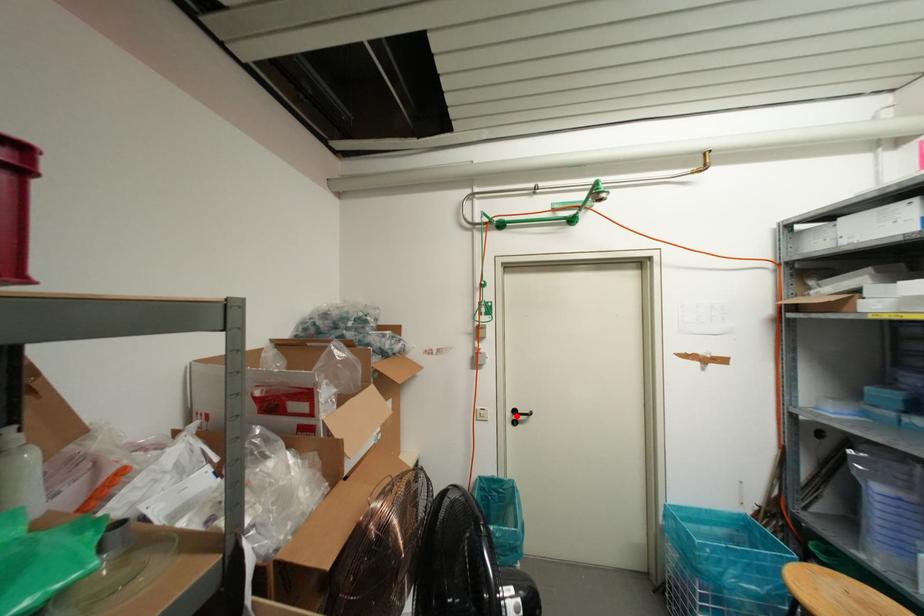
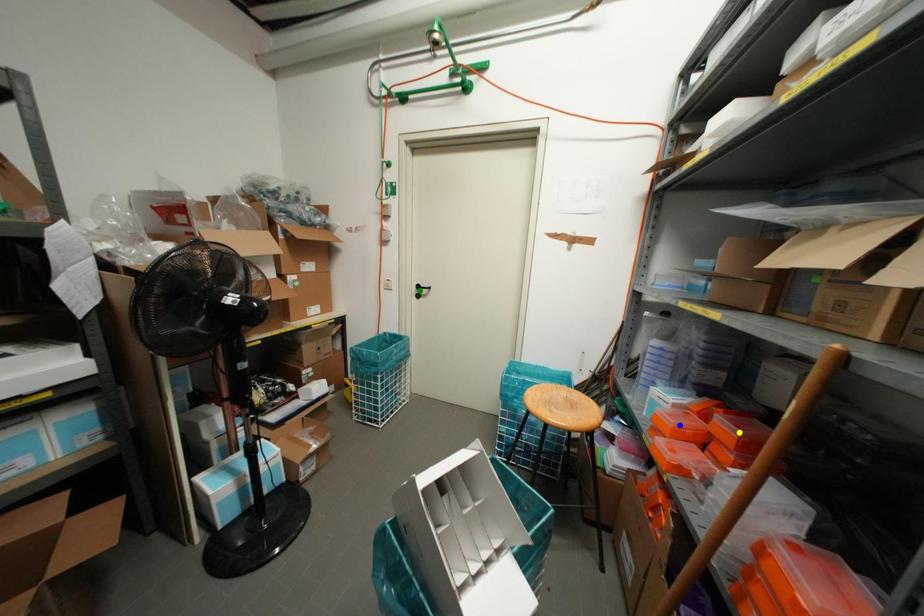
Question: I am providing you with two images of the same scene from different viewpoints. A red point is marked on the first image. You are given multiple points on the second image. In image 2, which mark is for the same physical point as the one in image 1?

Choices:
 (A) blue point
 (B) yellow point
 (C) green point

Answer: (C)